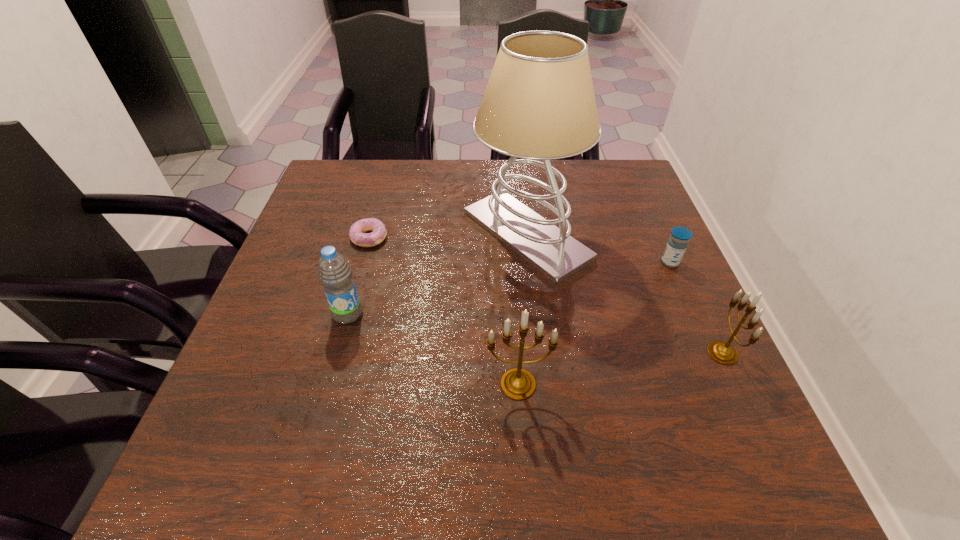
What are the coordinates of `blank area located 0.400m on the back of the medicine` in the screenshot? It's located at (628, 168).

Locate an element on the screen. This screenshot has height=540, width=960. vacant point located 0.300m on the right of the water bottle is located at coordinates (505, 314).

At what (x,y) coordinates should I click in order to perform the action: click on object located at the far edge. Please return your answer as a coordinate pair (x, y). The height and width of the screenshot is (540, 960). Looking at the image, I should click on (539, 104).

Image resolution: width=960 pixels, height=540 pixels. What are the coordinates of `object that is at the near edge` in the screenshot? It's located at (517, 383).

Find the location of a particular element. The image size is (960, 540). doughnut that is positioned at the left edge is located at coordinates (357, 231).

This screenshot has height=540, width=960. I want to click on water bottle that is positioned at the left edge, so (334, 272).

Image resolution: width=960 pixels, height=540 pixels. Identify the location of candelabrum that is at the right edge. (722, 352).

I want to click on medicine that is at the right edge, so pyautogui.click(x=677, y=243).

Find the location of a particular element. This screenshot has height=540, width=960. vacant space at the far edge of the desktop is located at coordinates (395, 202).

This screenshot has width=960, height=540. In the image, there is a desktop. Find the location of `vacant region at the near edge`. vacant region at the near edge is located at coordinates (577, 386).